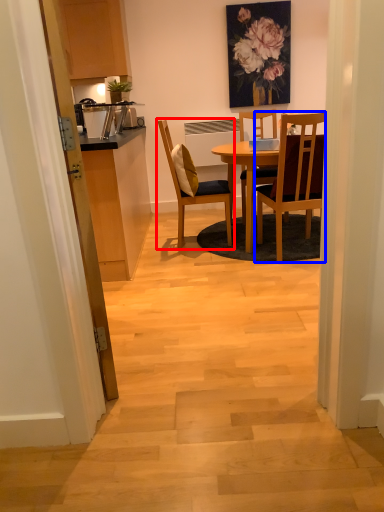
Question: Which object is closer to the camera taking this photo, chair (highlighted by a red box) or chair (highlighted by a blue box)?

Choices:
 (A) chair
 (B) chair

Answer: (B)